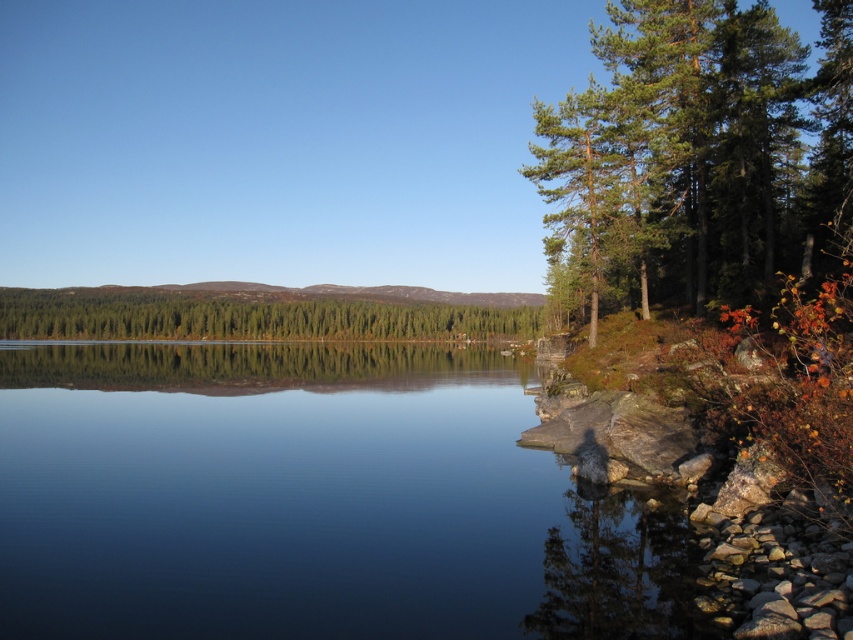
Question: Which object appears closest to the camera in this image?

Choices:
 (A) transparent water at center
 (B) green needle-like trees at right
 (C) green matte forest at center

Answer: (A)

Question: Among these objects, which one is farthest from the camera?

Choices:
 (A) green needle-like trees at right
 (B) transparent water at center

Answer: (A)

Question: Among these points, which one is farthest from the camera?

Choices:
 (A) (39, 320)
 (B) (815, 156)

Answer: (A)

Question: Is green needle-like trees at right to the left of green matte forest at center from the viewer's perspective?

Choices:
 (A) yes
 (B) no

Answer: (B)

Question: Is green needle-like trees at right smaller than green matte forest at center?

Choices:
 (A) yes
 (B) no

Answer: (B)

Question: Considering the relative positions of transparent water at center and green matte forest at center in the image provided, where is transparent water at center located with respect to green matte forest at center?

Choices:
 (A) above
 (B) below

Answer: (B)